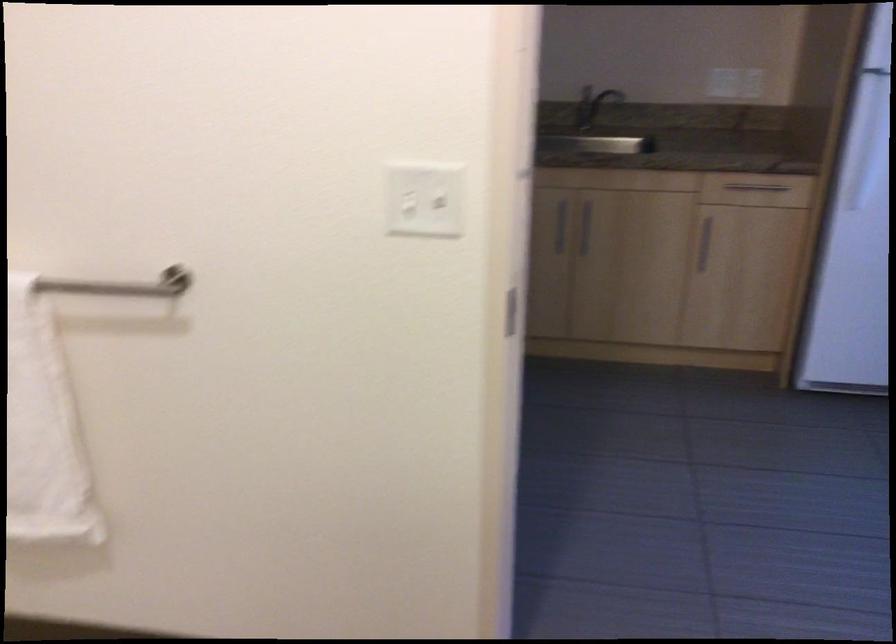
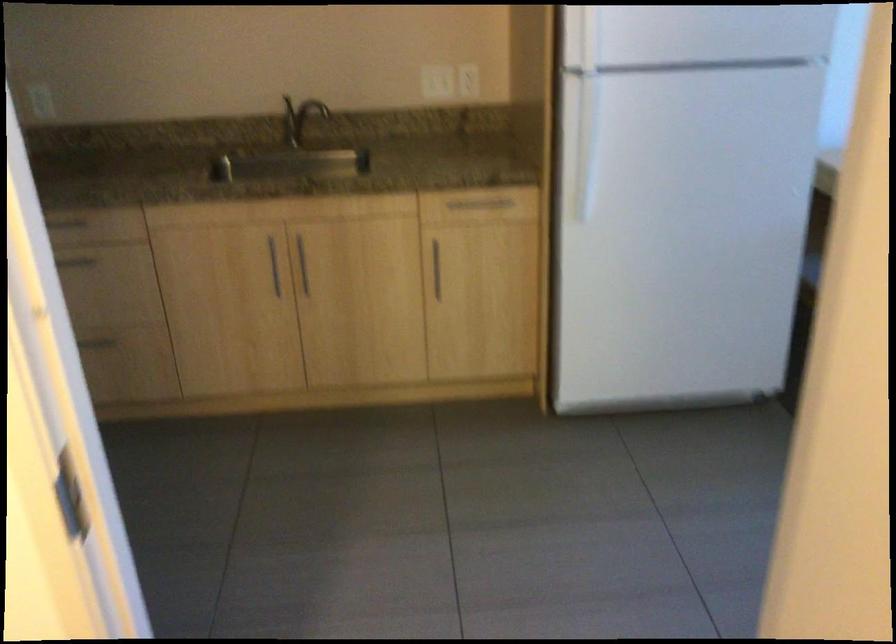
Where in the second image is the point corresponding to (737,77) from the first image?

(468, 80)